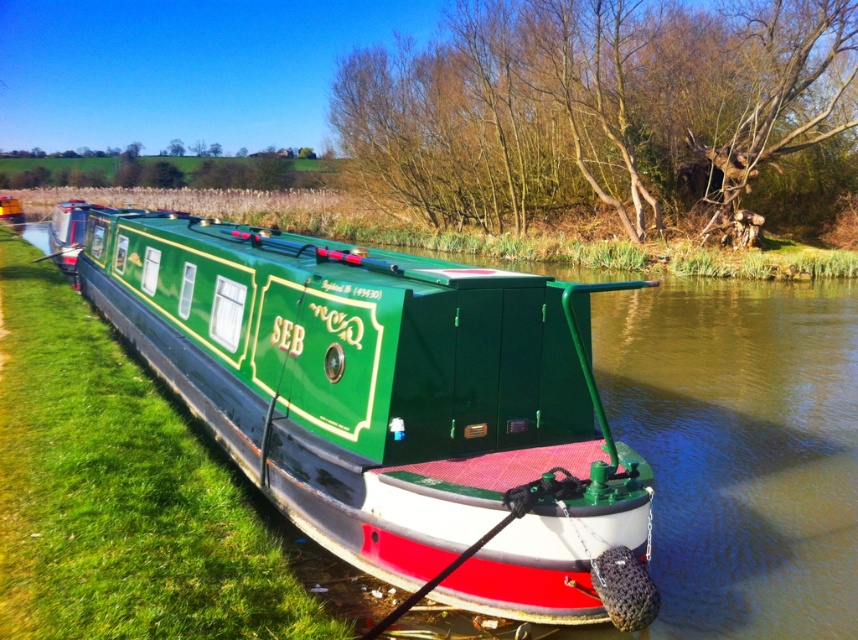
Question: Which object is farther from the camera taking this photo?

Choices:
 (A) green glossy canal boat at center
 (B) green grass at left

Answer: (A)

Question: Does green glossy canal boat at center have a larger size compared to green grass at left?

Choices:
 (A) no
 (B) yes

Answer: (B)

Question: Does green glossy canal boat at center come in front of green grass at left?

Choices:
 (A) yes
 (B) no

Answer: (B)

Question: Observing the image, what is the correct spatial positioning of green glossy canal boat at center in reference to green grass at left?

Choices:
 (A) right
 (B) left

Answer: (A)

Question: Which point is closer to the camera?

Choices:
 (A) green glossy canal boat at center
 (B) green grass at left

Answer: (B)